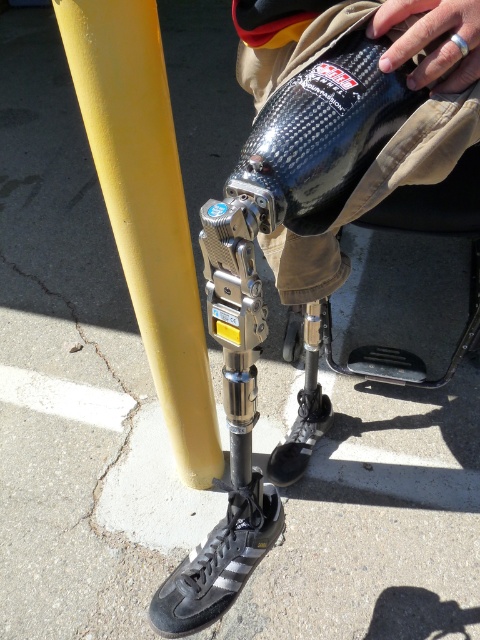
Question: Which object is closer to the camera taking this photo?

Choices:
 (A) yellow matte pole at left
 (B) carbon fiber bottle at center
 (C) black matte shoe at lower center

Answer: (B)

Question: Can you confirm if carbon fiber bottle at center is bigger than black leather shoe at lower center?

Choices:
 (A) yes
 (B) no

Answer: (B)

Question: Which object is positioned farthest from the carbon fiber bottle at center?

Choices:
 (A) yellow matte pole at left
 (B) black matte shoe at lower center

Answer: (B)

Question: Which point appears closest to the camera in this image?

Choices:
 (A) (130, 13)
 (B) (269, 544)
 (C) (326, 420)
 (D) (349, 148)

Answer: (D)

Question: From the image, what is the correct spatial relationship of yellow matte pole at left in relation to black leather shoe at lower center?

Choices:
 (A) left
 (B) right

Answer: (A)

Question: Is yellow matte pole at left positioned before black matte shoe at lower center?

Choices:
 (A) yes
 (B) no

Answer: (A)